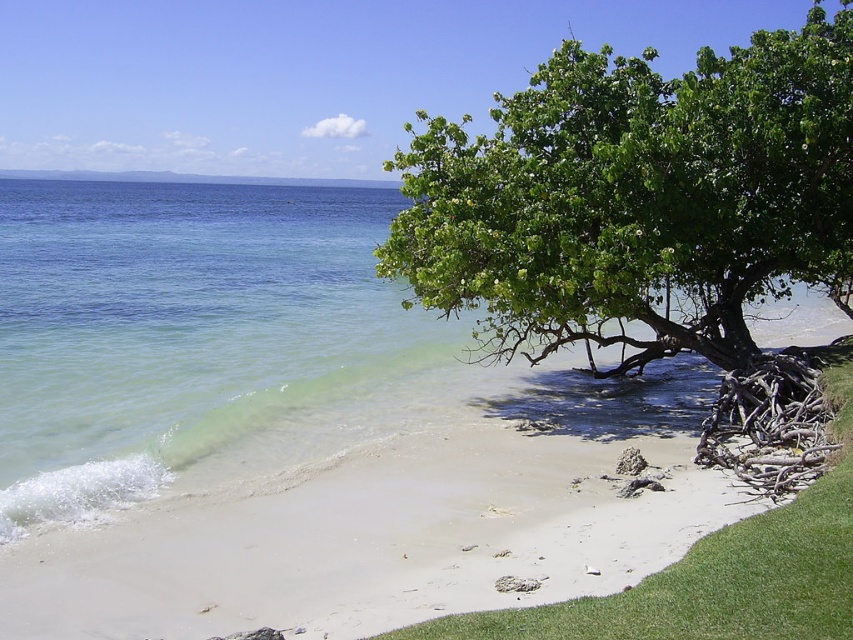
Question: Can you confirm if white sand at lower right is smaller than green leafy tree at upper right?

Choices:
 (A) no
 (B) yes

Answer: (B)

Question: From the image, what is the correct spatial relationship of white sand at lower right in relation to green leafy tree at upper right?

Choices:
 (A) right
 (B) left

Answer: (B)

Question: Does white sand at lower right have a lesser width compared to green leafy tree at upper right?

Choices:
 (A) yes
 (B) no

Answer: (B)

Question: Among these objects, which one is farthest from the camera?

Choices:
 (A) green leafy tree at upper right
 (B) white sand at lower right

Answer: (A)

Question: Which point is closer to the camera?

Choices:
 (A) green leafy tree at upper right
 (B) white sand at lower right

Answer: (B)